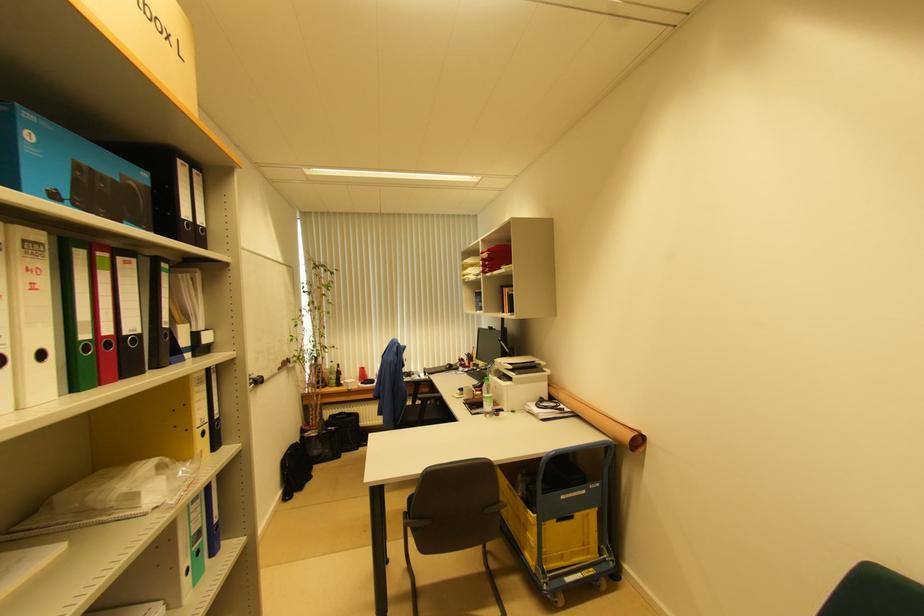
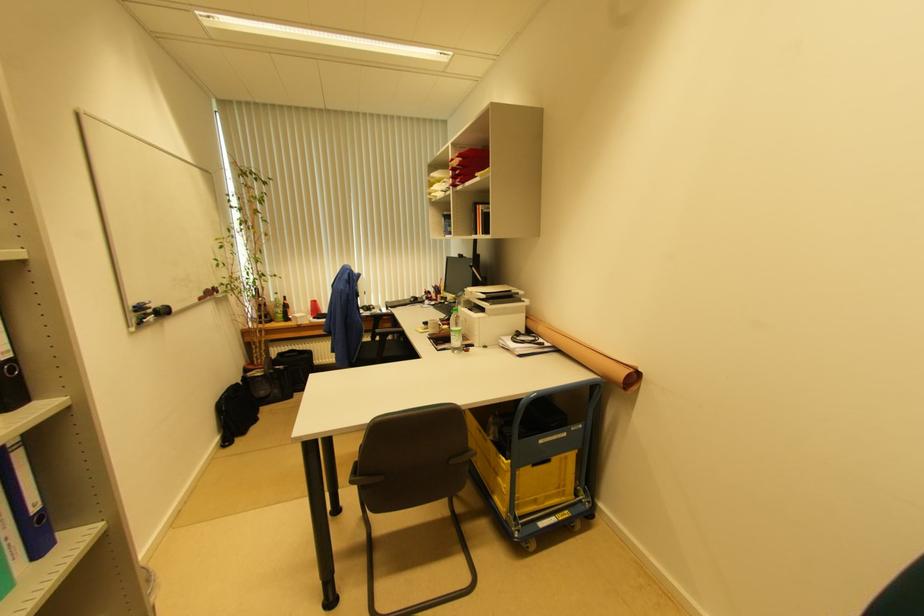
Question: The images are taken continuously from a first-person perspective. In which direction are you moving?

Choices:
 (A) Left
 (B) Right
 (C) Forward
 (D) Backward

Answer: (C)